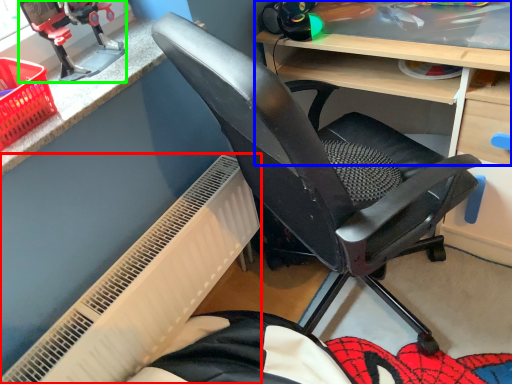
Question: Which object is positioned closest to radiator (highlighted by a red box)? Select from desk (highlighted by a blue box) and sport equipment (highlighted by a green box).

Choices:
 (A) desk
 (B) sport equipment

Answer: (B)